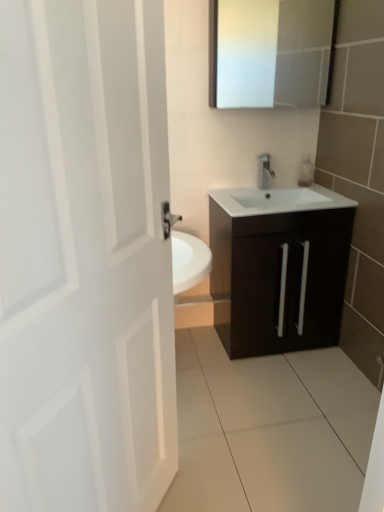
Question: Based on their sizes in the image, would you say white matte door at left is bigger or smaller than white glossy medicine cabinet at upper center?

Choices:
 (A) small
 (B) big

Answer: (B)

Question: Considering their positions, is white matte door at left located in front of or behind white glossy medicine cabinet at upper center?

Choices:
 (A) behind
 (B) front

Answer: (B)

Question: Estimate the real-world distances between objects in this image. Which object is closer to the white glossy medicine cabinet at upper center?

Choices:
 (A) matte dark brown cabinet at center
 (B) white matte door at left
 (C) satin nickel faucet at center

Answer: (C)

Question: Which of these objects is positioned closest to the satin nickel faucet at center?

Choices:
 (A) white glossy medicine cabinet at upper center
 (B) matte dark brown cabinet at center
 (C) white matte door at left

Answer: (B)